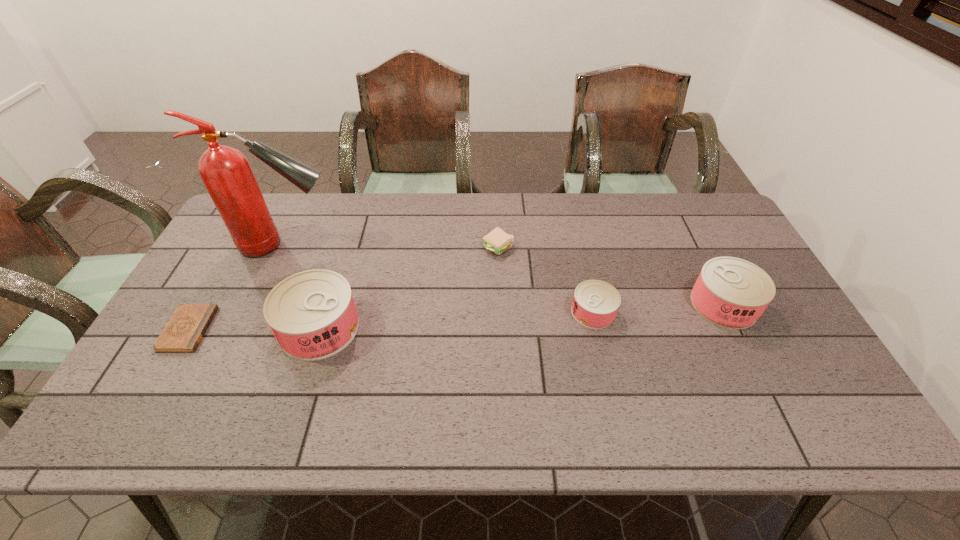
You are a GUI agent. You are given a task and a screenshot of the screen. Output one action in this format:
    pyautogui.click(x=<x>, y=<y>)
    Task: Click on the object located in the far left corner section of the desktop
    This screenshot has width=960, height=540.
    Given the screenshot: What is the action you would take?
    pyautogui.click(x=226, y=173)

The width and height of the screenshot is (960, 540). In the image, there is a desktop. Identify the location of vacant region at the far edge. (282, 232).

This screenshot has height=540, width=960. What are the coordinates of `free region at the near edge` in the screenshot? It's located at (472, 373).

Find the location of `vacant space at the left edge of the desktop`. vacant space at the left edge of the desktop is located at coordinates (225, 306).

Locate an element on the screen. Image resolution: width=960 pixels, height=540 pixels. free spot at the far left corner of the desktop is located at coordinates (224, 237).

Image resolution: width=960 pixels, height=540 pixels. I want to click on empty location between the fire extinguisher and the shortest object, so click(237, 287).

In order to click on vacant space that is in between the fire extinguisher and the shortest object in this screenshot , I will do `click(237, 287)`.

Find the location of a particular element. free space between the fire extinguisher and the diary is located at coordinates (237, 287).

This screenshot has width=960, height=540. In order to click on empty location between the second can from left to right and the second shortest can in this screenshot , I will do `click(659, 308)`.

At what (x,y) coordinates should I click in order to perform the action: click on free space between the leftmost can and the shortest object. Please return your answer as a coordinate pair (x, y). Looking at the image, I should click on coord(254,328).